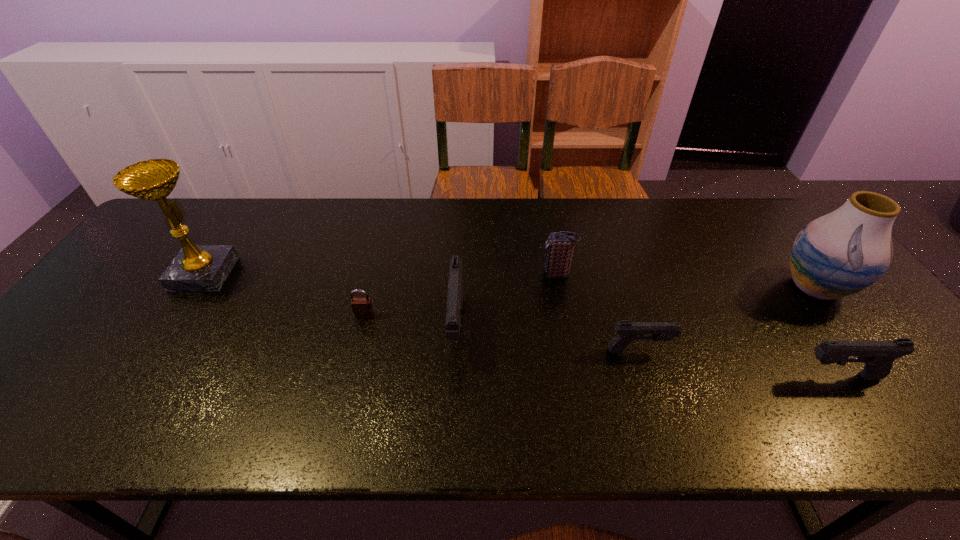
Image resolution: width=960 pixels, height=540 pixels. I want to click on vacant area situated 0.310m at the barrel of the second pistol from left to right, so click(x=800, y=350).

Where is `free spot located 0.060m at the barrel of the second tallest pistol`? free spot located 0.060m at the barrel of the second tallest pistol is located at coordinates (772, 376).

You are a GUI agent. You are given a task and a screenshot of the screen. Output one action in this format:
    pyautogui.click(x=<x>, y=<y>)
    Task: Click on the free space located 0.290m at the barrel of the second tallest pistol
    The width and height of the screenshot is (960, 540).
    Given the screenshot: What is the action you would take?
    pyautogui.click(x=671, y=376)

Where is `vacant region located at the barrel of the second tallest pistol`? vacant region located at the barrel of the second tallest pistol is located at coordinates (662, 376).

Locate an element on the screen. The image size is (960, 540). free space located 0.200m on the back of the sixth shortest object is located at coordinates (764, 221).

This screenshot has height=540, width=960. Identify the location of vacant space located with the zip open on the clutch bag. (519, 274).

Where is `vacant space located with the zip open on the clutch bag`? This screenshot has height=540, width=960. vacant space located with the zip open on the clutch bag is located at coordinates (420, 274).

The image size is (960, 540). I want to click on vacant region located with the zip open on the clutch bag, so click(x=495, y=274).

The image size is (960, 540). What are the coordinates of `vacant area situated 0.190m on the front-facing side of the leftmost object` in the screenshot? It's located at tap(297, 274).

At what (x,y) coordinates should I click in order to perform the action: click on vacant space situated 0.080m on the front-facing side of the sixth object from right to left. Please return your answer as a coordinate pair (x, y). The width and height of the screenshot is (960, 540). Looking at the image, I should click on click(x=357, y=343).